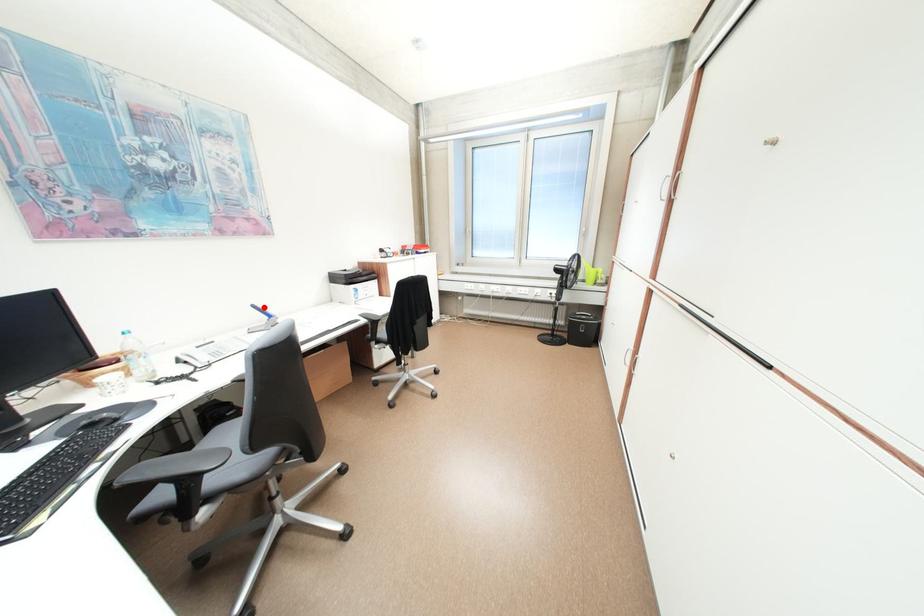
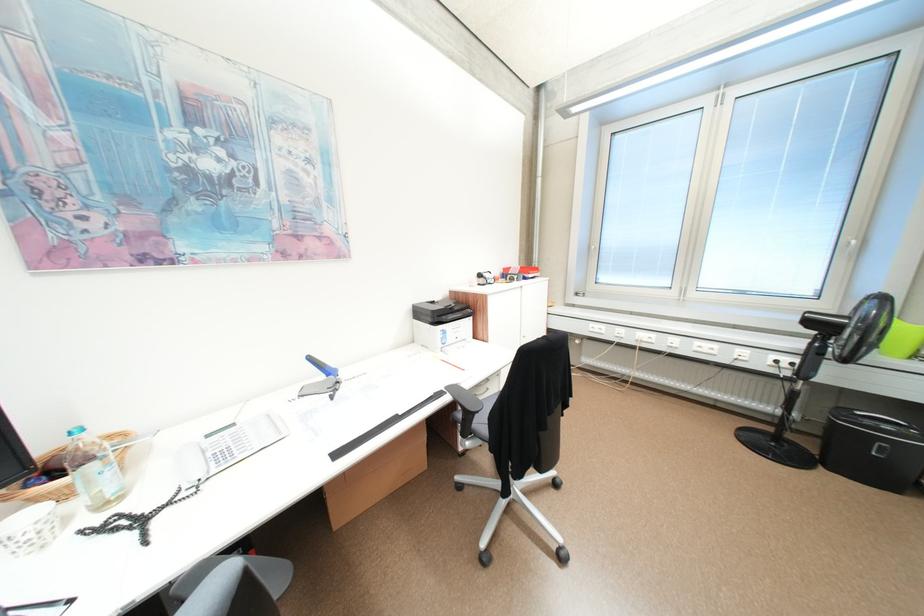
Locate, in the second image, the point that corresponds to the highlighted location in the first image.

(320, 359)